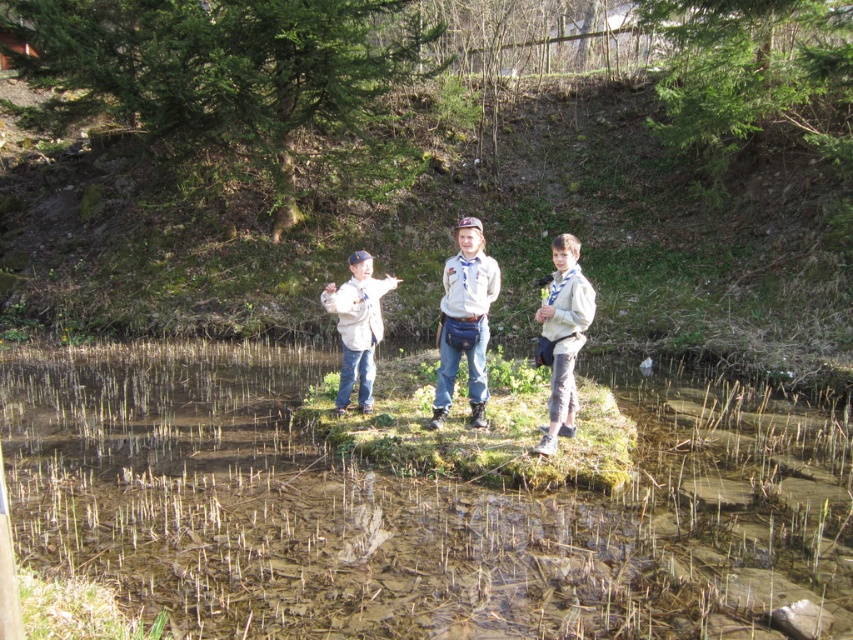
Question: Does clear water at center come behind light brown uniform at center?

Choices:
 (A) yes
 (B) no

Answer: (B)

Question: Does clear water at center appear over gray cotton shirt at center?

Choices:
 (A) no
 (B) yes

Answer: (A)

Question: Which point appears farthest from the camera in this image?

Choices:
 (A) (370, 332)
 (B) (483, 406)
 (C) (477, 600)

Answer: (A)

Question: Which point is closer to the camera?

Choices:
 (A) clear water at center
 (B) light brown denim jacket at center
 (C) light brown uniform at center
 (D) gray cotton shirt at center

Answer: (A)

Question: Is light brown uniform at center positioned behind light brown denim jacket at center?

Choices:
 (A) yes
 (B) no

Answer: (B)

Question: Which is farther from the clear water at center?

Choices:
 (A) light brown uniform at center
 (B) light brown denim jacket at center

Answer: (B)